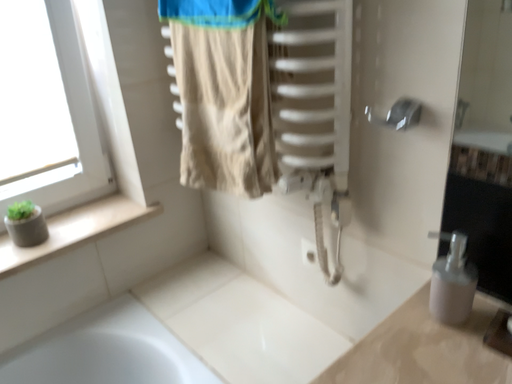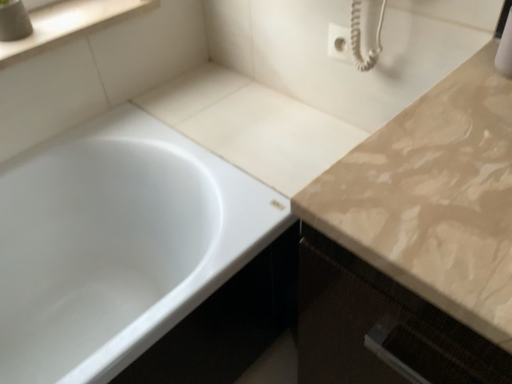
Question: How did the camera likely rotate when shooting the video?

Choices:
 (A) rotated downward
 (B) rotated upward

Answer: (A)